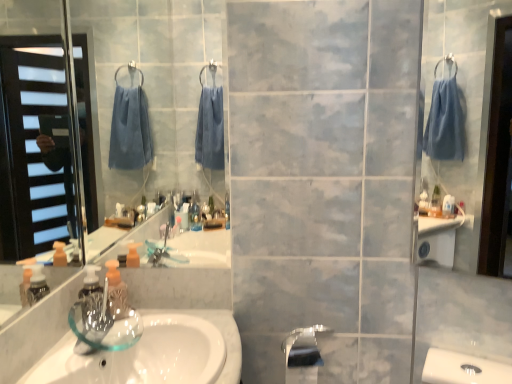
Where is `unoccupied region to the right of transparent glass soap dispenser at lower left`? unoccupied region to the right of transparent glass soap dispenser at lower left is located at coordinates (157, 327).